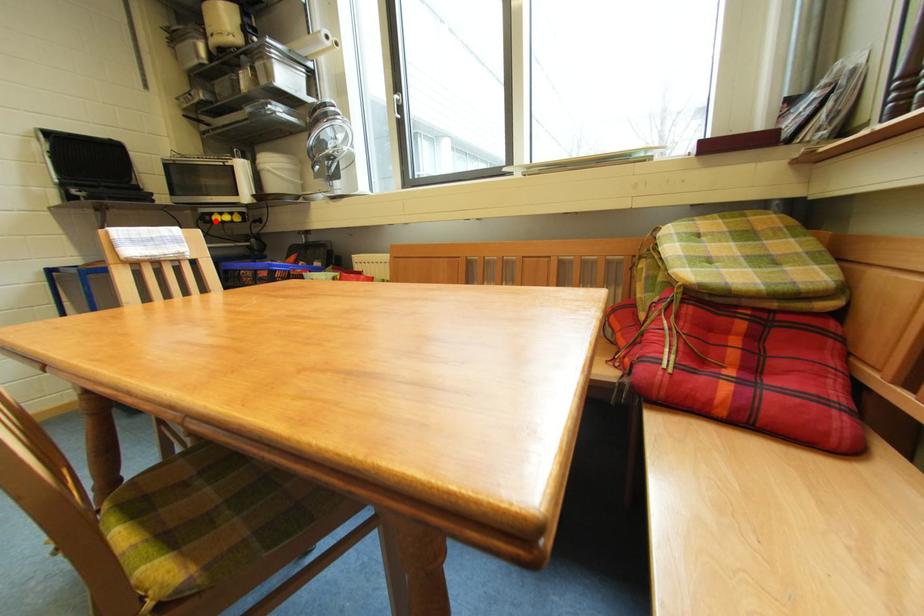
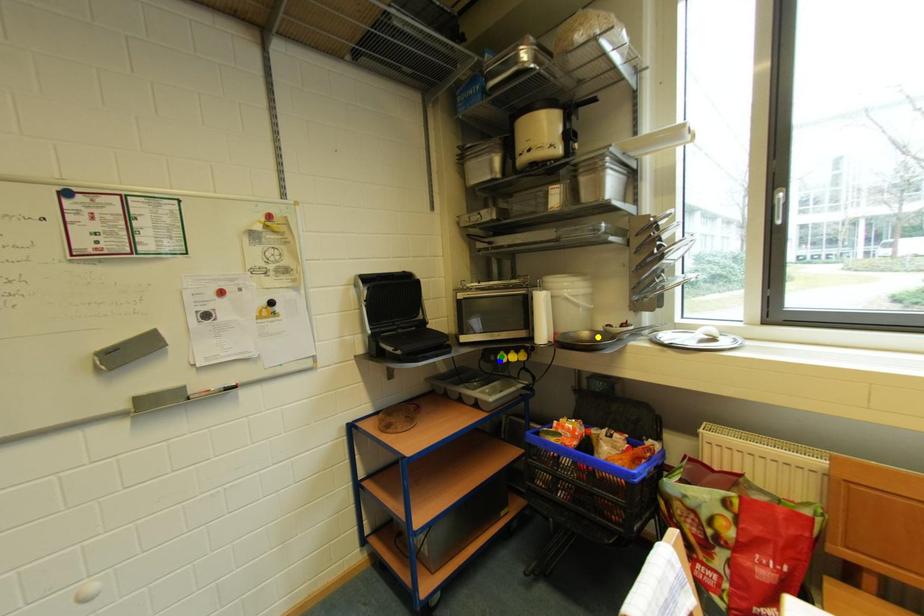
Question: I am providing you with two images of the same scene from different viewpoints. A red point is marked on the first image. You are given multiple points on the second image. In image 2, which mark is for the same physical point as the one in image 1?

Choices:
 (A) blue point
 (B) yellow point
 (C) green point

Answer: (A)